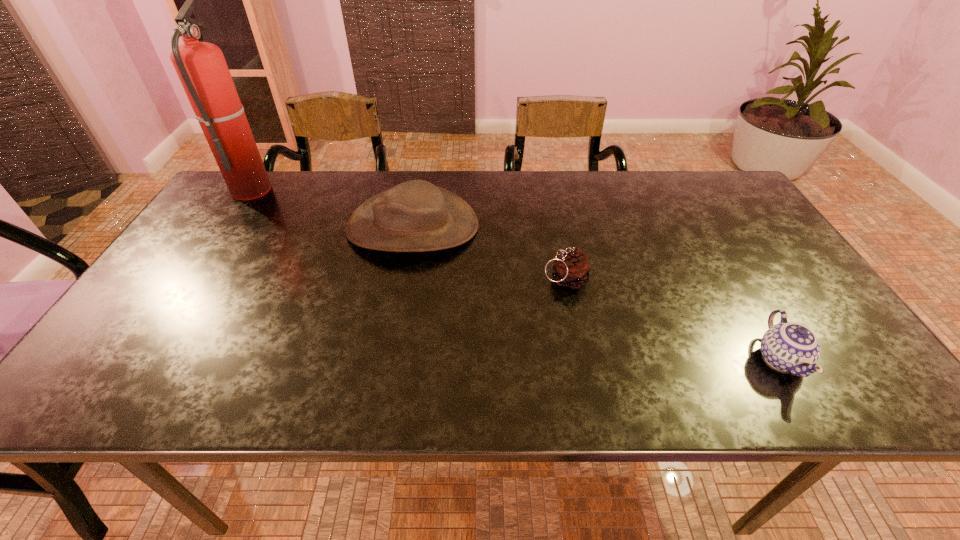
The image size is (960, 540). In order to click on free spot located 0.110m with a leaf charm attached to the third farthest object in this screenshot , I will do click(x=497, y=280).

Where is `blank space located 0.380m with a leaf charm attached to the third farthest object`? blank space located 0.380m with a leaf charm attached to the third farthest object is located at coordinates (389, 280).

Where is `fire extinguisher that is at the far edge`? Image resolution: width=960 pixels, height=540 pixels. fire extinguisher that is at the far edge is located at coordinates (201, 67).

Find the location of a particular element. The image size is (960, 540). cowboy hat present at the far edge is located at coordinates (415, 216).

At what (x,y) coordinates should I click in order to perform the action: click on object located in the near edge section of the desktop. Please return your answer as a coordinate pair (x, y). The width and height of the screenshot is (960, 540). Looking at the image, I should click on (790, 347).

At what (x,y) coordinates should I click in order to perform the action: click on object located at the left edge. Please return your answer as a coordinate pair (x, y). This screenshot has width=960, height=540. Looking at the image, I should click on coord(201,67).

Where is `object present at the right edge`? This screenshot has height=540, width=960. object present at the right edge is located at coordinates (790, 347).

Image resolution: width=960 pixels, height=540 pixels. I want to click on object that is positioned at the far left corner, so click(201, 67).

Identify the location of object that is at the near right corner. This screenshot has height=540, width=960. (790, 347).

Identify the location of vacant space at the far edge. Image resolution: width=960 pixels, height=540 pixels. (674, 197).